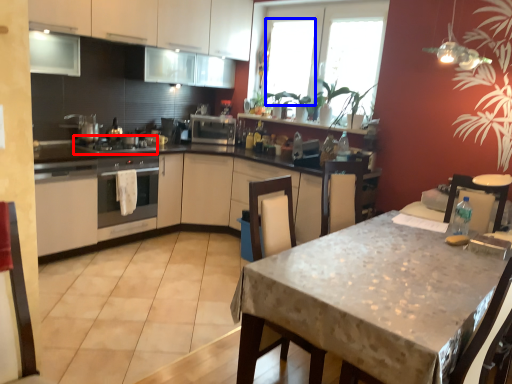
Question: Which of the following is the closest to the observer, appliance (highlighted by a red box) or window (highlighted by a blue box)?

Choices:
 (A) appliance
 (B) window

Answer: (A)